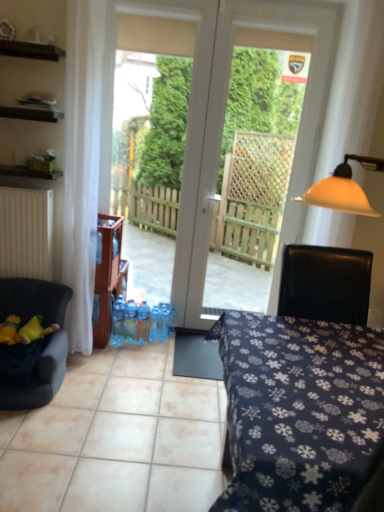
Question: Can you confirm if dark blue fabric table at center is bigger than blue plastic bottle at center, the fourth bottle from the left?

Choices:
 (A) yes
 (B) no

Answer: (A)

Question: Can you confirm if dark blue fabric table at center is wider than blue plastic bottle at center, the fourth bottle from the left?

Choices:
 (A) yes
 (B) no

Answer: (A)

Question: From the image's perspective, is dark blue fabric table at center under blue plastic bottle at center, which is the 2th bottle from right to left?

Choices:
 (A) yes
 (B) no

Answer: (A)

Question: Is dark blue fabric table at center not near blue plastic bottle at center, which is the 2th bottle from right to left?

Choices:
 (A) yes
 (B) no

Answer: (A)

Question: Could blue plastic bottle at center, the fourth bottle from the left, be considered to be inside dark blue fabric table at center?

Choices:
 (A) no
 (B) yes

Answer: (A)

Question: From a real-world perspective, is yellow fabric toy at lower left, positioned as the 1th toy in left-to-right order, positioned above or below dark blue fabric table at center?

Choices:
 (A) above
 (B) below

Answer: (B)

Question: Is point (13, 320) positioned closer to the camera than point (382, 343)?

Choices:
 (A) farther
 (B) closer

Answer: (A)

Question: Considering the positions of yellow fabric toy at lower left, marked as the 2th toy in a right-to-left arrangement, and dark blue fabric table at center in the image, is yellow fabric toy at lower left, marked as the 2th toy in a right-to-left arrangement, wider or thinner than dark blue fabric table at center?

Choices:
 (A) thin
 (B) wide

Answer: (A)

Question: Which is correct: yellow fabric toy at lower left, positioned as the 1th toy in left-to-right order, is inside dark blue fabric table at center, or outside of it?

Choices:
 (A) outside
 (B) inside

Answer: (A)

Question: Is blue plastic bottle at center, which ranks as the fifth bottle in left-to-right order, taller or shorter than matte black shelf at upper left, arranged as the 1th cabinetry when ordered from the bottom?

Choices:
 (A) tall
 (B) short

Answer: (A)

Question: From a real-world perspective, relative to matte black shelf at upper left, arranged as the 1th cabinetry when ordered from the bottom, is blue plastic bottle at center, the 1th bottle in the right-to-left sequence, vertically above or below?

Choices:
 (A) below
 (B) above

Answer: (A)

Question: Is blue plastic bottle at center, the 1th bottle in the right-to-left sequence, spatially inside matte black shelf at upper left, arranged as the 1th cabinetry when ordered from the bottom, or outside of it?

Choices:
 (A) outside
 (B) inside

Answer: (A)

Question: Considering their positions, is blue plastic bottle at center, which ranks as the fifth bottle in left-to-right order, located in front of or behind matte black shelf at upper left, the 2th cabinetry in the top-to-bottom sequence?

Choices:
 (A) behind
 (B) front

Answer: (A)

Question: Does point (39, 116) appear closer or farther from the camera than point (1, 333)?

Choices:
 (A) farther
 (B) closer

Answer: (B)

Question: Based on their positions, is wooden cabinet at upper left, the first cabinetry when ordered from top to bottom, located to the left or right of yellow plush toy at left, arranged as the 2th toy when viewed from the left?

Choices:
 (A) right
 (B) left

Answer: (B)